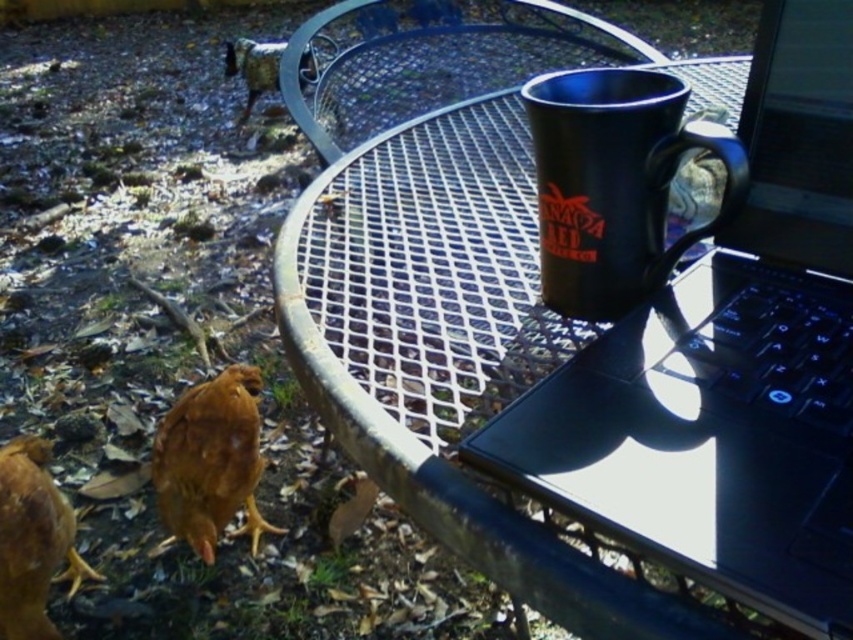
Does metallic mesh table at center appear over golden brown feathers at lower left?

Yes.

Between point (375, 368) and point (74, 589), which one is positioned in front?

Point (375, 368) is in front.

Identify the location of metallic mesh table at center. This screenshot has width=853, height=640. (575, 388).

Which is in front, point (548, 220) or point (218, 531)?

Positioned in front is point (548, 220).

Who is higher up, black matte mug at upper center or brown matte chicken at lower left?

black matte mug at upper center is above.

Between point (546, 268) and point (204, 506), which one is positioned behind?

Point (204, 506)

Where is `black matte mug at upper center`? The image size is (853, 640). black matte mug at upper center is located at coordinates (614, 182).

Who is higher up, black matte mug at upper center or golden brown feathers at lower left?

Positioned higher is black matte mug at upper center.

Which is in front, point (602, 182) or point (20, 564)?

Point (602, 182) is in front.

What do you see at coordinates (614, 182) in the screenshot? I see `black matte mug at upper center` at bounding box center [614, 182].

Where is `black matte mug at upper center`? black matte mug at upper center is located at coordinates (614, 182).